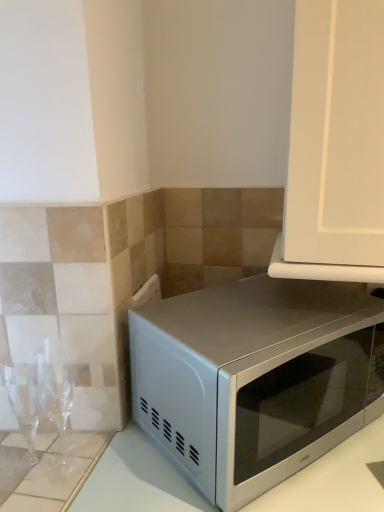
Question: From a real-world perspective, is satin white microwave at lower right on satin silver microwave at lower right?

Choices:
 (A) no
 (B) yes

Answer: (A)

Question: Does satin white microwave at lower right have a lesser width compared to satin silver microwave at lower right?

Choices:
 (A) no
 (B) yes

Answer: (A)

Question: From a real-world perspective, is satin white microwave at lower right below satin silver microwave at lower right?

Choices:
 (A) no
 (B) yes

Answer: (B)

Question: Is satin white microwave at lower right not within satin silver microwave at lower right?

Choices:
 (A) yes
 (B) no

Answer: (A)

Question: Would you say satin white microwave at lower right contains satin silver microwave at lower right?

Choices:
 (A) yes
 (B) no

Answer: (B)

Question: Is satin white microwave at lower right to the left of satin silver microwave at lower right from the viewer's perspective?

Choices:
 (A) no
 (B) yes

Answer: (A)

Question: Does satin silver microwave at lower right have a lesser width compared to satin white microwave at lower right?

Choices:
 (A) yes
 (B) no

Answer: (A)

Question: Are satin silver microwave at lower right and satin white microwave at lower right beside each other?

Choices:
 (A) yes
 (B) no

Answer: (B)

Question: Is satin silver microwave at lower right taller than satin white microwave at lower right?

Choices:
 (A) no
 (B) yes

Answer: (A)

Question: Is satin white microwave at lower right at the back of satin silver microwave at lower right?

Choices:
 (A) yes
 (B) no

Answer: (B)

Question: Is satin white microwave at lower right inside satin silver microwave at lower right?

Choices:
 (A) no
 (B) yes

Answer: (A)

Question: Can you confirm if satin silver microwave at lower right is shorter than satin white microwave at lower right?

Choices:
 (A) yes
 (B) no

Answer: (A)

Question: Based on their positions, is satin white microwave at lower right located to the left or right of satin silver microwave at lower right?

Choices:
 (A) right
 (B) left

Answer: (A)